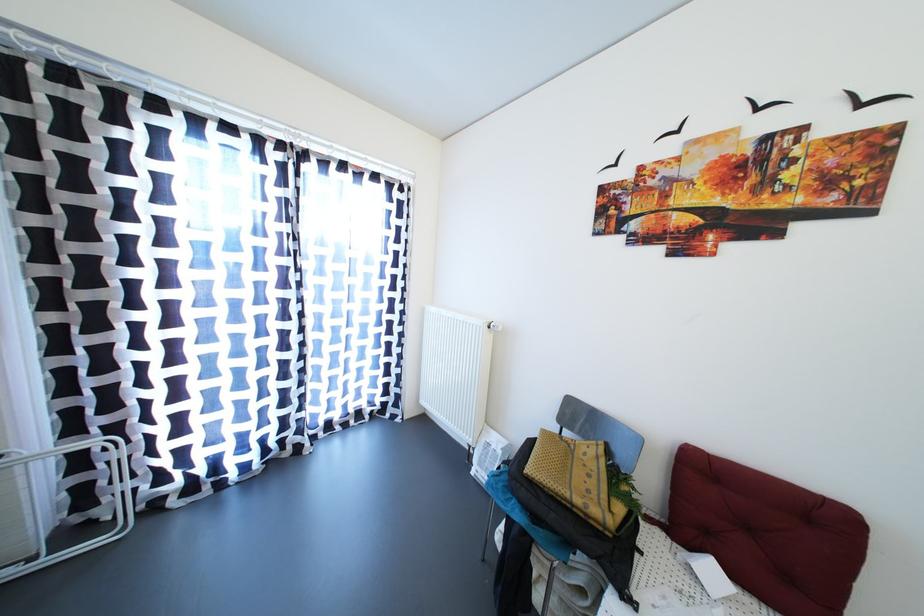
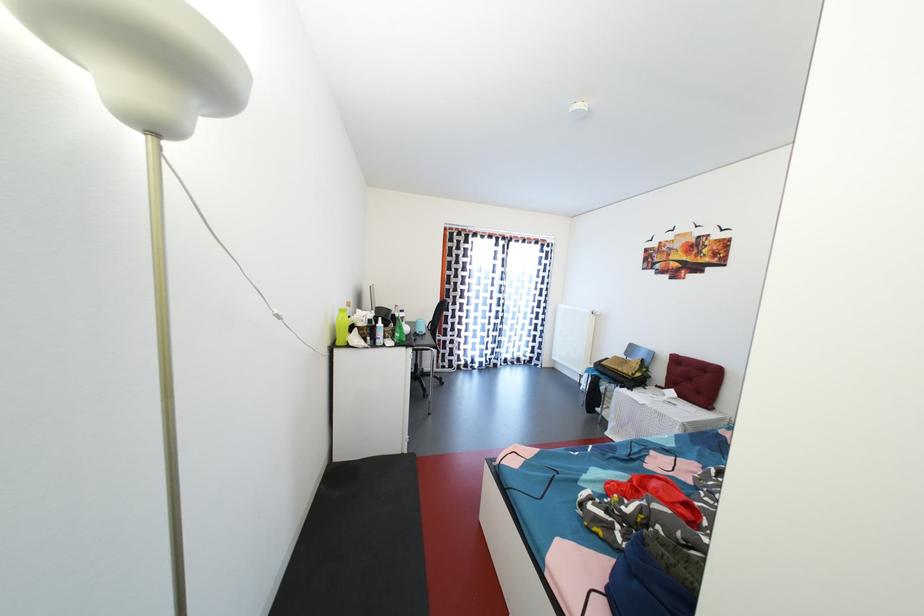
Question: I am providing you with two images of the same scene from different viewpoints. Which of the following objects are not visible in image2?

Choices:
 (A) white cord switch
 (B) red tufted cushion
 (C) guitar control knob
 (D) black chair sitting surface

Answer: (B)